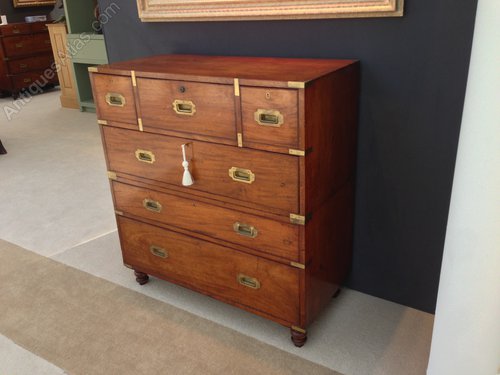
You are a GUI agent. You are given a task and a screenshot of the screen. Output one action in this format:
    pyautogui.click(x=<x>, y=<y>)
    Task: Click on the handle
    
    Given the screenshot: What is the action you would take?
    pyautogui.click(x=152, y=206)